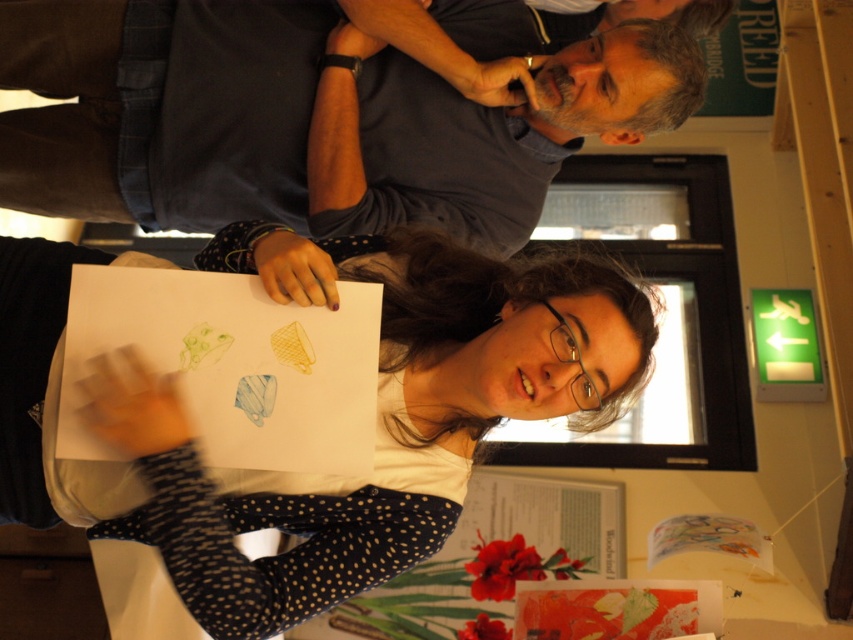
You are a participant in the discussion looking at the white paper at center and the dark blue shirt at upper center. Which object is taller?

The white paper at center is taller than the dark blue shirt at upper center.

You are standing in the room facing the central figure holding the white paper at center. There is also a green illuminated sign at upper right. Which object is higher up in your field of view?

The green illuminated sign at upper right is higher up in your field of view since it is located above the white paper at center.